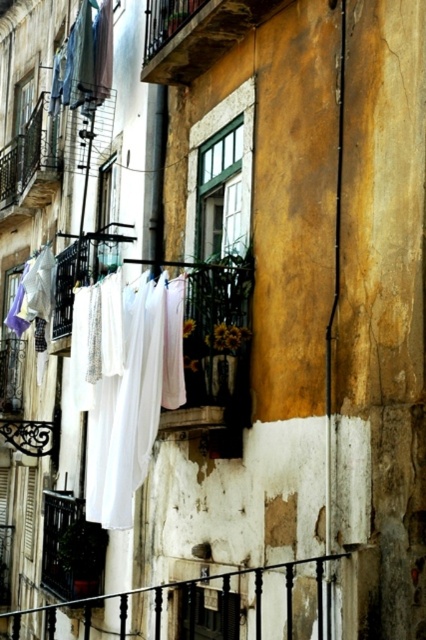
You are a window cleaner standing on the balcony and need to reach both the white fabric at center and the white cotton shirt at upper left. Which object is closer to the ground?

The white fabric at center is closer to the ground because it is positioned under the white cotton shirt at upper left.

You are a window cleaner standing on the balcony. You need to move the white fabric at center and the white cotton shirt at upper left to clean the balcony railing. Which object should you move first if you want to start with the larger one?

The white fabric at center should be moved first because its width is larger than the white cotton shirt at upper left.